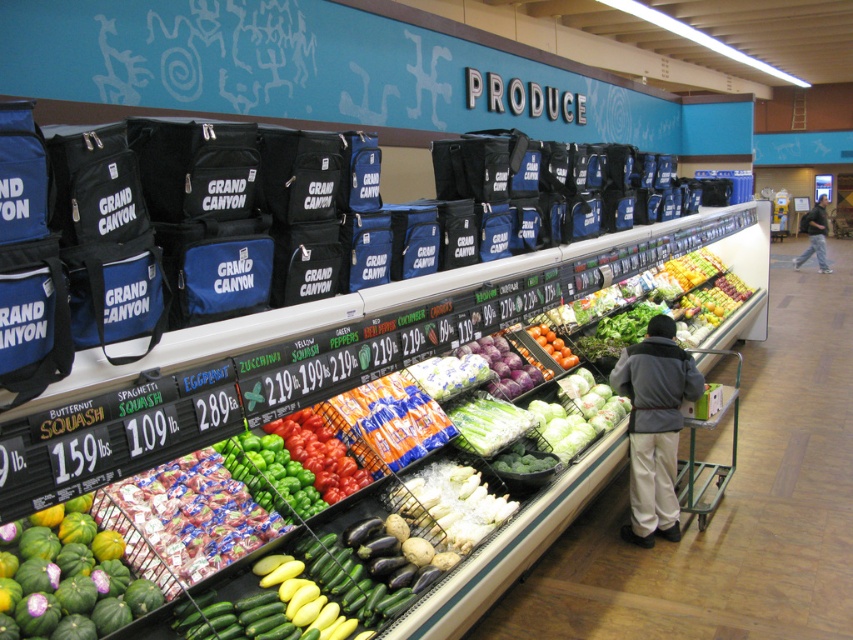
Can you confirm if green metal cart at lower right is shorter than shiny red tomatoes at center?

In fact, green metal cart at lower right may be taller than shiny red tomatoes at center.

Image resolution: width=853 pixels, height=640 pixels. I want to click on green metal cart at lower right, so click(706, 461).

Locate an element on the screen. green metal cart at lower right is located at coordinates (706, 461).

Does green matte squash at lower left have a greater width compared to green matte bell peppers at center?

In fact, green matte squash at lower left might be narrower than green matte bell peppers at center.

Which is below, green matte squash at lower left or green matte bell peppers at center?

green matte squash at lower left is below.

Is point (83, 556) farther from camera compared to point (311, 420)?

No, (83, 556) is in front of (311, 420).

This screenshot has width=853, height=640. In order to click on green matte squash at lower left in this screenshot , I will do `click(67, 577)`.

Can you confirm if green plastic produce at center is positioned above dark gray hoodie at center?

No, green plastic produce at center is not above dark gray hoodie at center.

Who is more forward, (405, 291) or (813, 220)?

Point (405, 291)

You are a GUI agent. You are given a task and a screenshot of the screen. Output one action in this format:
    pyautogui.click(x=<x>, y=<y>)
    Task: Click on the green plastic produce at center
    
    Given the screenshot: What is the action you would take?
    pyautogui.click(x=321, y=352)